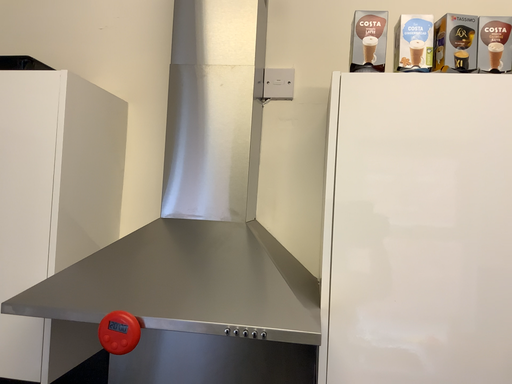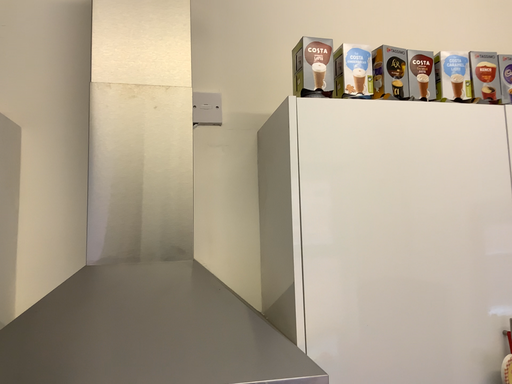
Question: Which way did the camera rotate in the video?

Choices:
 (A) rotated right
 (B) rotated left

Answer: (A)